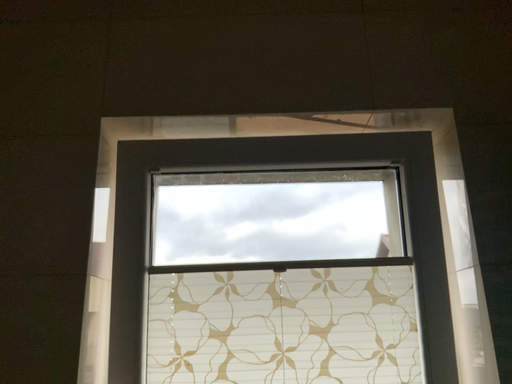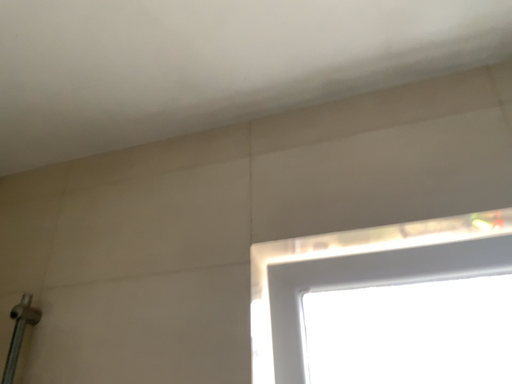
Question: Which way did the camera rotate in the video?

Choices:
 (A) rotated upward
 (B) rotated downward

Answer: (A)